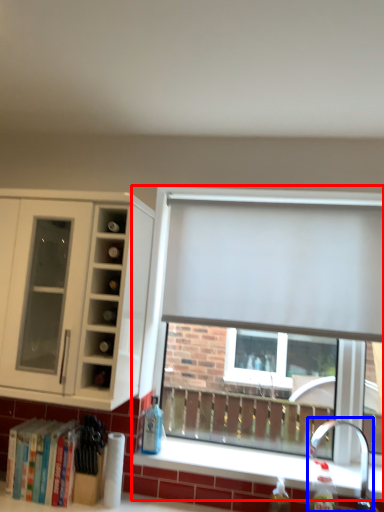
Question: Among these objects, which one is farthest to the camera, window (highlighted by a red box) or faucet (highlighted by a blue box)?

Choices:
 (A) window
 (B) faucet

Answer: (A)